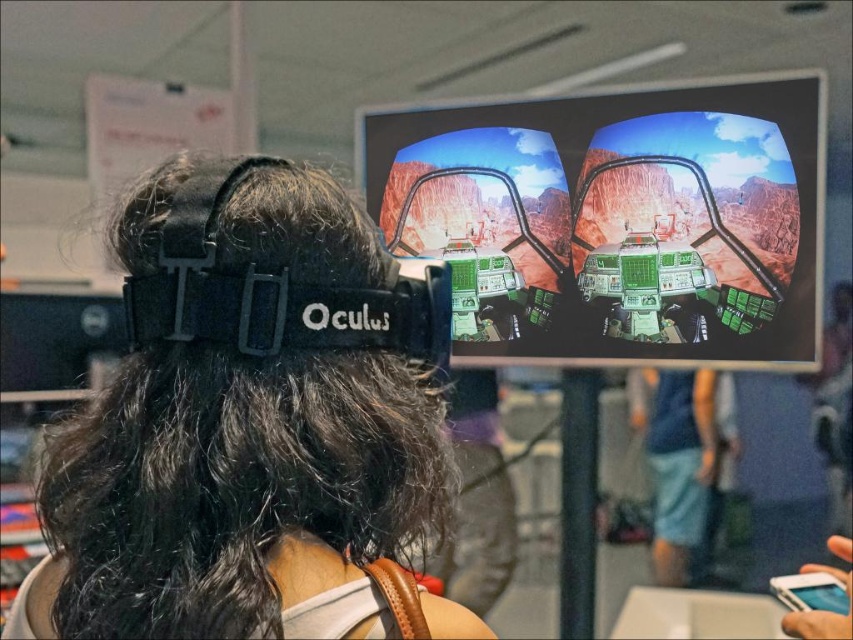
Question: Where is black matte vr headset at upper center located in relation to white matte phone at center in the image?

Choices:
 (A) below
 (B) above

Answer: (B)

Question: Which point is closer to the camera?

Choices:
 (A) (654, 435)
 (B) (200, 636)
 (C) (811, 621)

Answer: (B)

Question: Where is black matte vr headset at upper center located in relation to white matte phone at center in the image?

Choices:
 (A) above
 (B) below

Answer: (A)

Question: Based on their relative distances, which object is nearer to the blue denim shorts at lower right?

Choices:
 (A) white matte phone at center
 (B) green matte cockpit at center

Answer: (B)

Question: Is black matte vr headset at upper center bigger than white matte phone at center?

Choices:
 (A) yes
 (B) no

Answer: (A)

Question: Which of the following is the closest to the observer?

Choices:
 (A) green matte cockpit at center
 (B) white matte phone at center

Answer: (B)